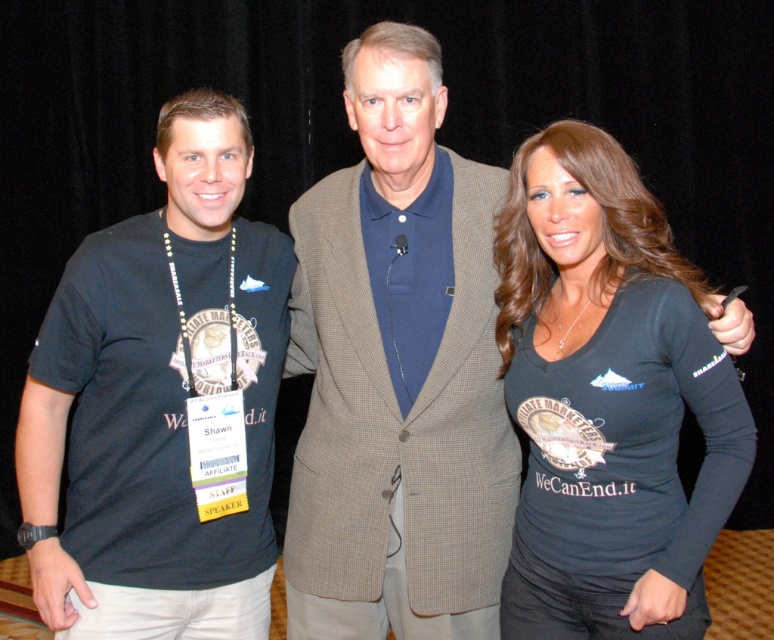
Who is more forward, (141, 323) or (632, 636)?

Point (632, 636) is more forward.

Where is `black t-shirt at left`? This screenshot has width=774, height=640. black t-shirt at left is located at coordinates (156, 403).

Based on the photo, does blue cotton polo shirt at center appear under black t-shirt at left?

No, blue cotton polo shirt at center is not below black t-shirt at left.

Is blue cotton polo shirt at center above black t-shirt at left?

Yes, blue cotton polo shirt at center is above black t-shirt at left.

Is point (457, 390) positioned behind point (241, 316)?

No, (457, 390) is in front of (241, 316).

I want to click on blue cotton polo shirt at center, so click(x=396, y=371).

Does point (392, 204) come behind point (612, 620)?

That is True.

Does blue cotton polo shirt at center have a greater height compared to black matte shirt at right?

Yes, blue cotton polo shirt at center is taller than black matte shirt at right.

Does point (389, 100) come closer to viewer compared to point (560, 364)?

No, it is behind (560, 364).

Where is `blue cotton polo shirt at center`? This screenshot has height=640, width=774. blue cotton polo shirt at center is located at coordinates (396, 371).